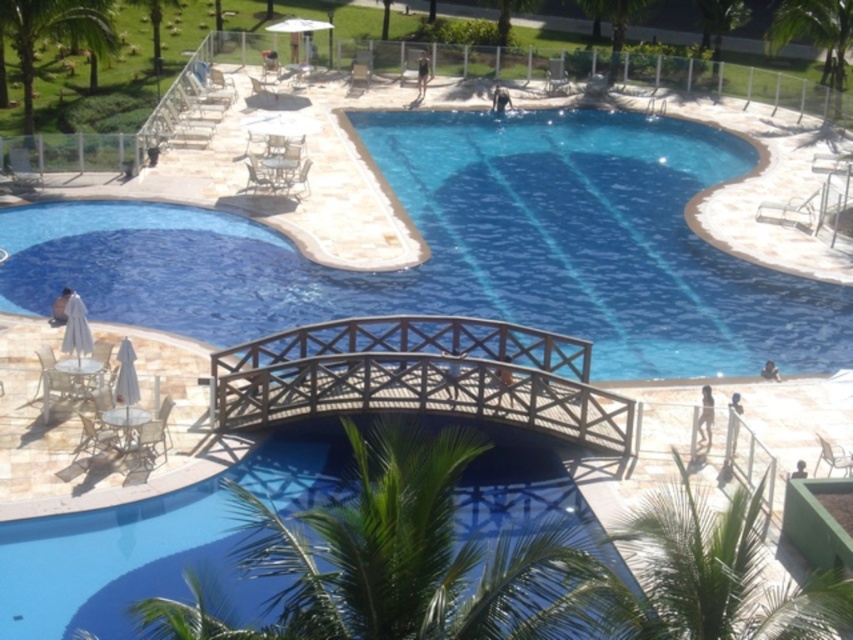
Based on the photo, which of these two, clear blue water at center or matte gray chair at upper center, stands shorter?

matte gray chair at upper center

Can you confirm if clear blue water at center is smaller than matte gray chair at upper center?

No.

Does point (770, 307) lie behind point (368, 88)?

No.

Identify the location of clear blue water at center. The height and width of the screenshot is (640, 853). (467, 250).

Can you confirm if green leafy palm tree at center is positioned to the right of green leafy palm tree at upper center?

No, green leafy palm tree at center is not to the right of green leafy palm tree at upper center.

The height and width of the screenshot is (640, 853). Find the location of `green leafy palm tree at center`. green leafy palm tree at center is located at coordinates (404, 561).

Where is `green leafy palm tree at center`? Image resolution: width=853 pixels, height=640 pixels. green leafy palm tree at center is located at coordinates (404, 561).

Is clear blue water at center further to the viewer compared to green leafy palm tree at upper left?

No, clear blue water at center is in front of green leafy palm tree at upper left.

Who is higher up, clear blue water at center or green leafy palm tree at upper left?

green leafy palm tree at upper left

Which is in front, point (566, 180) or point (94, 44)?

Point (94, 44) is in front.

The height and width of the screenshot is (640, 853). Identify the location of clear blue water at center. (467, 250).